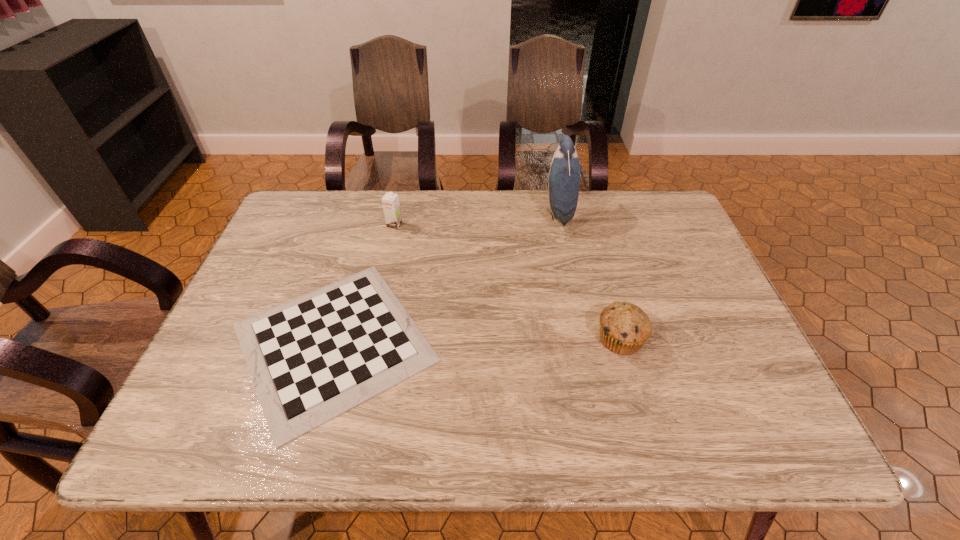
At what (x,y) coordinates should I click in order to perform the action: click on bird located in the far edge section of the desktop. Please return your answer as a coordinate pair (x, y). Looking at the image, I should click on (564, 175).

You are a GUI agent. You are given a task and a screenshot of the screen. Output one action in this format:
    pyautogui.click(x=<x>, y=<y>)
    Task: Click on the chocolate milk present at the far edge
    The height and width of the screenshot is (540, 960).
    Given the screenshot: What is the action you would take?
    pyautogui.click(x=390, y=201)

At what (x,y) coordinates should I click in order to perform the action: click on object that is at the near edge. Please return your answer as a coordinate pair (x, y). This screenshot has width=960, height=540. Looking at the image, I should click on (312, 358).

Where is `object located in the left edge section of the desktop`? object located in the left edge section of the desktop is located at coordinates (312, 358).

You are a GUI agent. You are given a task and a screenshot of the screen. Output one action in this format:
    pyautogui.click(x=<x>, y=<y>)
    Task: Click on the object present at the near left corner
    The height and width of the screenshot is (540, 960).
    Given the screenshot: What is the action you would take?
    pyautogui.click(x=312, y=358)

Find the location of a particular element. The height and width of the screenshot is (540, 960). vacant space at the far edge is located at coordinates (588, 225).

Image resolution: width=960 pixels, height=540 pixels. In the image, there is a desktop. In order to click on free region at the near edge in this screenshot , I will do pyautogui.click(x=435, y=414).

Image resolution: width=960 pixels, height=540 pixels. In the image, there is a desktop. In order to click on free space at the left edge in this screenshot , I will do `click(237, 349)`.

Where is `free region at the right edge of the desktop`? The width and height of the screenshot is (960, 540). free region at the right edge of the desktop is located at coordinates (739, 376).

Locate an element on the screen. This screenshot has width=960, height=540. vacant space at the far right corner of the desktop is located at coordinates (637, 205).